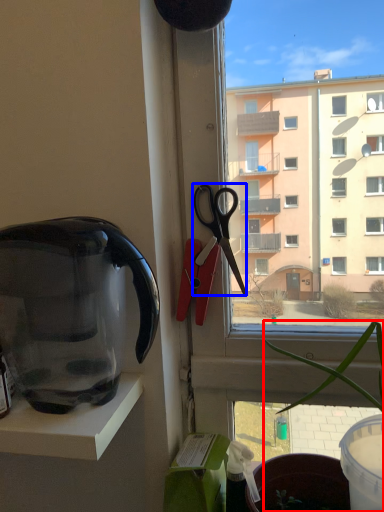
Question: Which of the following is the farthest to the observer, houseplant (highlighted by a red box) or scissors (highlighted by a blue box)?

Choices:
 (A) houseplant
 (B) scissors

Answer: (B)